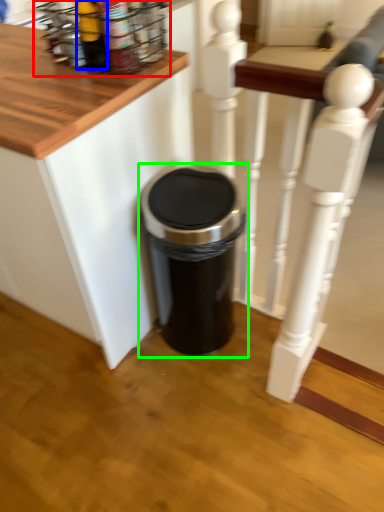
Question: Which object is the closest to the spice rack (highlighted by a red box)? Choose among these: bottle (highlighted by a blue box) or waste container (highlighted by a green box).

Choices:
 (A) bottle
 (B) waste container

Answer: (A)